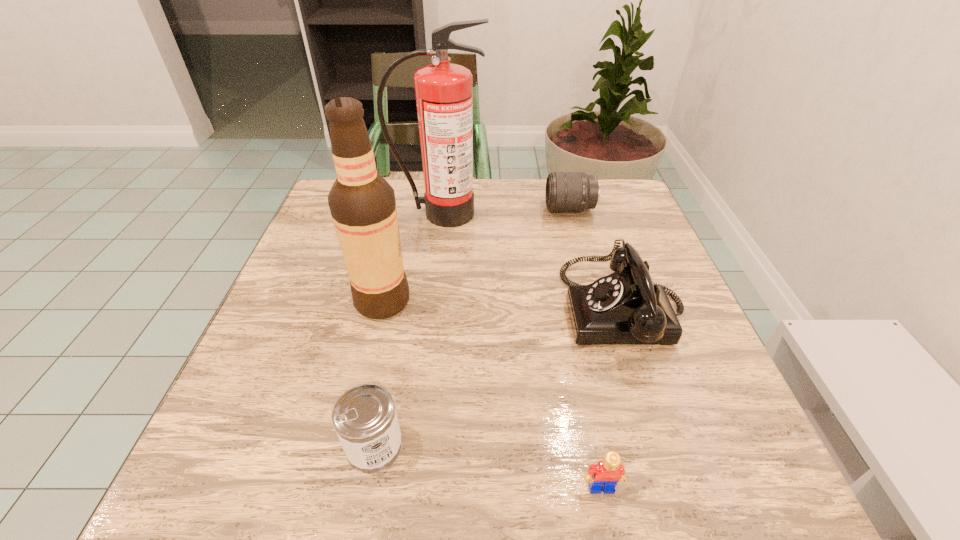
Locate which object is the fifth closest to the Lego. Please provide its 2D coordinates. Your answer should be formatted as a tuple, i.e. [(x, y)], where the tuple contains the x and y coordinates of a point satisfying the conditions above.

[(565, 191)]

Locate an element on the screen. blank area in the image that satisfies the following two spatial constraints: 1. on the surface of the telephoto lens; 2. on the front-facing side of the fire extinguisher is located at coordinates (571, 214).

You are a GUI agent. You are given a task and a screenshot of the screen. Output one action in this format:
    pyautogui.click(x=<x>, y=<y>)
    Task: Click on the blank area in the image that satisfies the following two spatial constraints: 1. on the dial of the telephone; 2. on the front-facing side of the Lego
    The height and width of the screenshot is (540, 960).
    Given the screenshot: What is the action you would take?
    pyautogui.click(x=684, y=488)